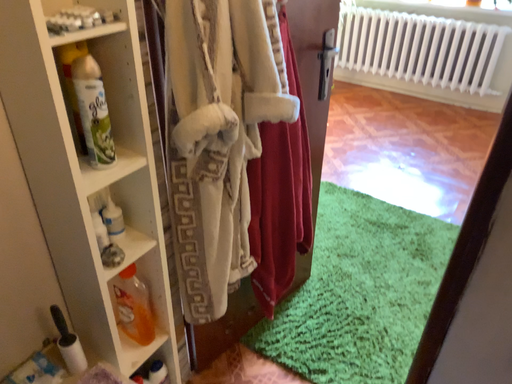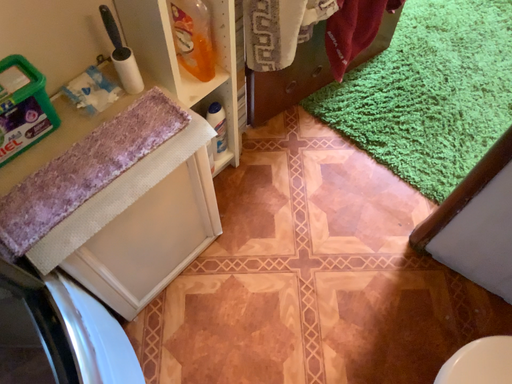
Question: How did the camera likely rotate when shooting the video?

Choices:
 (A) rotated upward
 (B) rotated downward

Answer: (B)